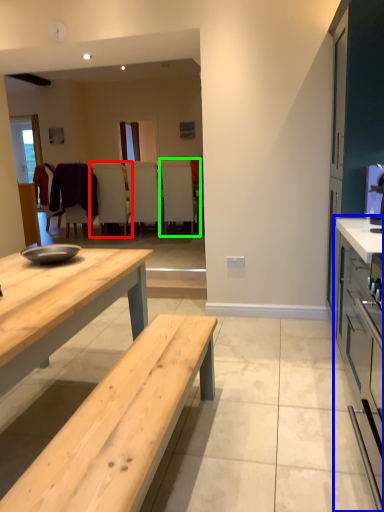
Question: Which object is positioned farthest from chair (highlighted by a red box)? Select from cabinetry (highlighted by a blue box) and chair (highlighted by a green box).

Choices:
 (A) cabinetry
 (B) chair

Answer: (A)